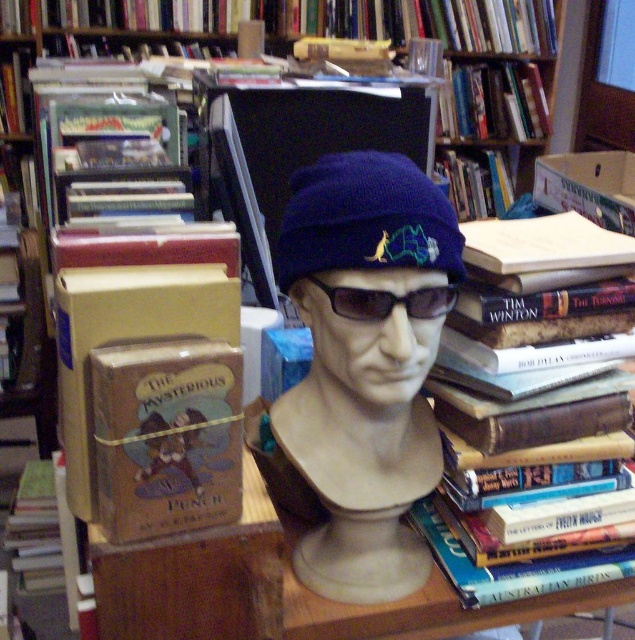
Based on the photo, you are an artist trying to sketch the central objects in the image. You notice two items at the center of the bust. Which one is closer to you, the navy blue knit beanie at center or the black plastic goggles at center?

The navy blue knit beanie at center is in front of the black plastic goggles at center, so it is closer to you.

You are an artist planning to paint a portrait of the bust in the center. You need to decide which object, the navy blue knit beanie at center or the black plastic goggles at center, should be emphasized in terms of vertical space. Based on their sizes, which object should you allocate more vertical space to in your painting?

The navy blue knit beanie at center has a greater height compared to the black plastic goggles at center, so you should allocate more vertical space to the navy blue knit beanie at center in your painting.

You are an interior designer arranging a display. You have two hats, the blue knitted hat at center and the navy blue knit beanie at center. Which hat is positioned closer to the viewer in the current setup?

The blue knitted hat at center is positioned closer to the viewer since it is in front of the navy blue knit beanie at center.